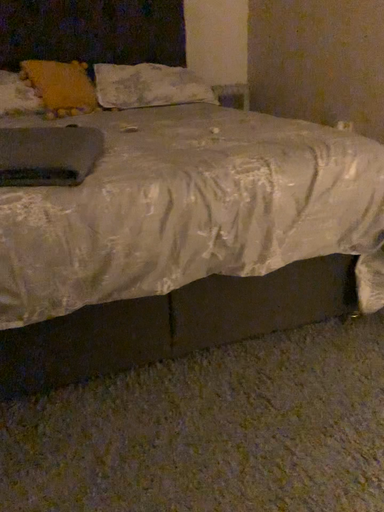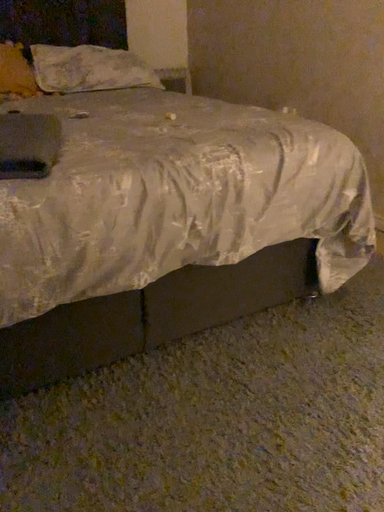
Question: How did the camera likely rotate when shooting the video?

Choices:
 (A) rotated left
 (B) rotated right

Answer: (B)